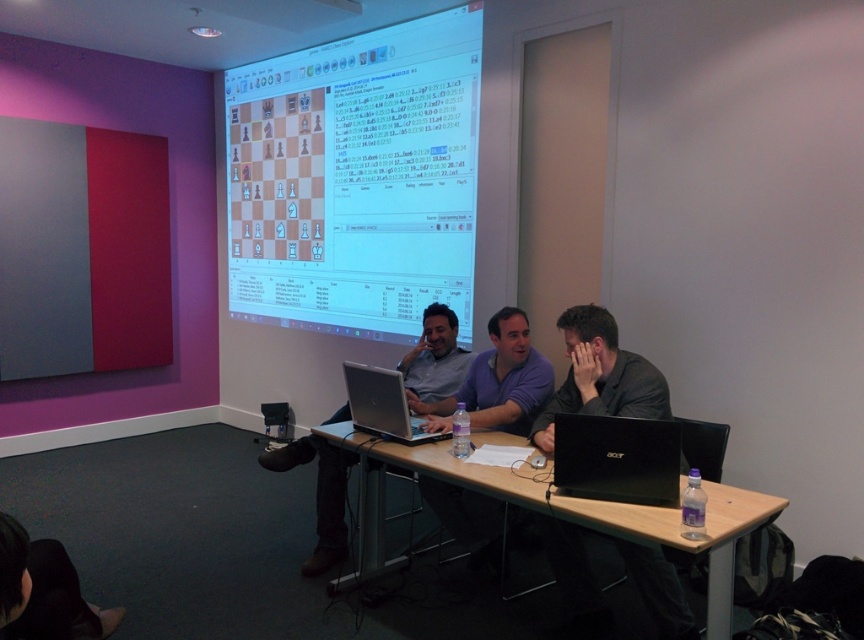
You are organizing a small presentation and need to place a matte gray laptop at center on the wooden table at center. Will the laptop fit comfortably on the table?

The wooden table at center is bigger than the matte gray laptop at center, so the laptop will fit comfortably on the table.

What are the coordinates of the white glossy projection screen at upper center?

The white glossy projection screen at upper center is located at coordinates (356,179).